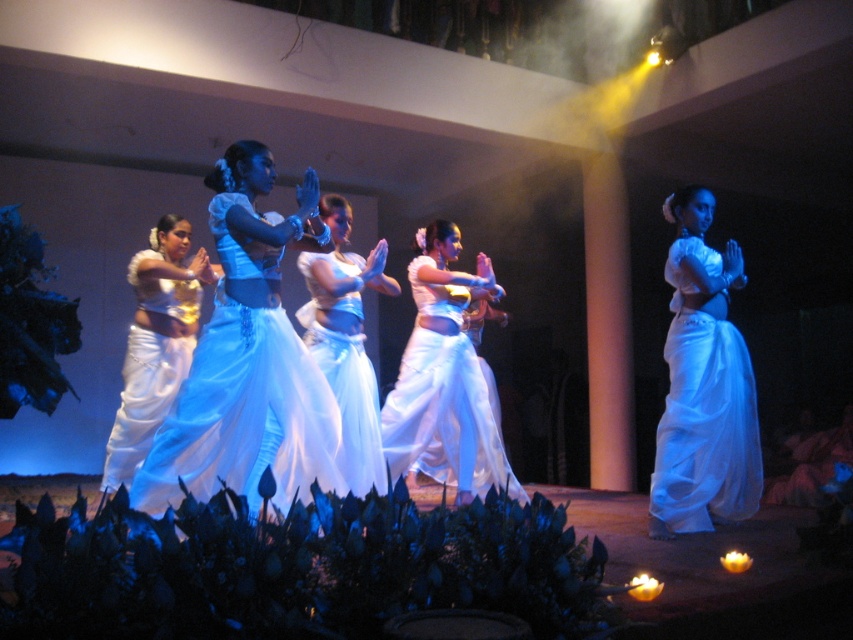
Who is positioned more to the left, white silk sari at center or white satin skirt at center?

From the viewer's perspective, white silk sari at center appears more on the left side.

You are a GUI agent. You are given a task and a screenshot of the screen. Output one action in this format:
    pyautogui.click(x=<x>, y=<y>)
    Task: Click on the white silk sari at center
    Image resolution: width=853 pixels, height=640 pixels.
    Given the screenshot: What is the action you would take?
    pyautogui.click(x=155, y=342)

Does white silk skirt at center appear under white silk sari at center?

Yes.

Is white silk skirt at center to the left of white silk sari at center from the viewer's perspective?

Incorrect, white silk skirt at center is not on the left side of white silk sari at center.

You are a GUI agent. You are given a task and a screenshot of the screen. Output one action in this format:
    pyautogui.click(x=<x>, y=<y>)
    Task: Click on the white silk skirt at center
    
    Given the screenshot: What is the action you would take?
    pyautogui.click(x=445, y=378)

Is point (718, 413) farther from camera compared to point (428, 264)?

That is False.

Does point (712, 476) come in front of point (498, 285)?

Yes, point (712, 476) is closer to viewer.

This screenshot has height=640, width=853. I want to click on white satin sari at center, so click(703, 385).